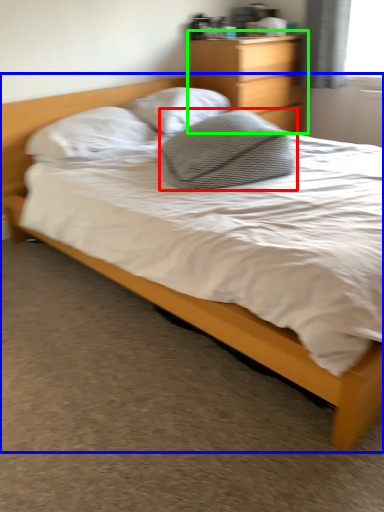
Question: Which object is positioned farthest from pillow (highlighted by a red box)? Select from bed (highlighted by a blue box) and nightstand (highlighted by a green box).

Choices:
 (A) bed
 (B) nightstand

Answer: (B)